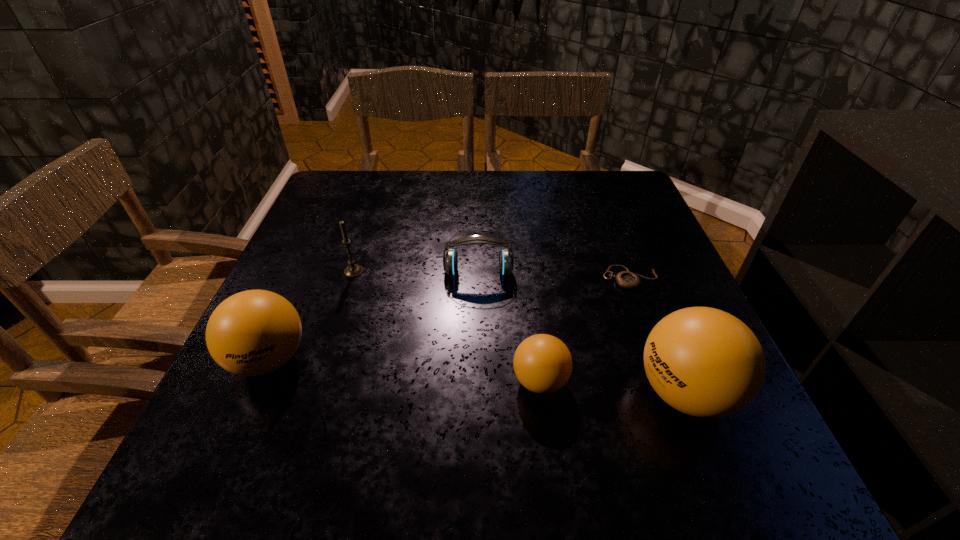
Find the location of `ping-pong ball that is the closest to the candle`. ping-pong ball that is the closest to the candle is located at coordinates (252, 333).

Where is `free spot that satisfies the following two spatial constraints: 1. on the ear cups of the headset; 2. on the left side of the shortest object`? free spot that satisfies the following two spatial constraints: 1. on the ear cups of the headset; 2. on the left side of the shortest object is located at coordinates (478, 278).

This screenshot has height=540, width=960. Find the location of `vacant space that satisfies the following two spatial constraints: 1. on the front side of the fifth object from right to left; 2. on the right side of the pocket watch`. vacant space that satisfies the following two spatial constraints: 1. on the front side of the fifth object from right to left; 2. on the right side of the pocket watch is located at coordinates (351, 278).